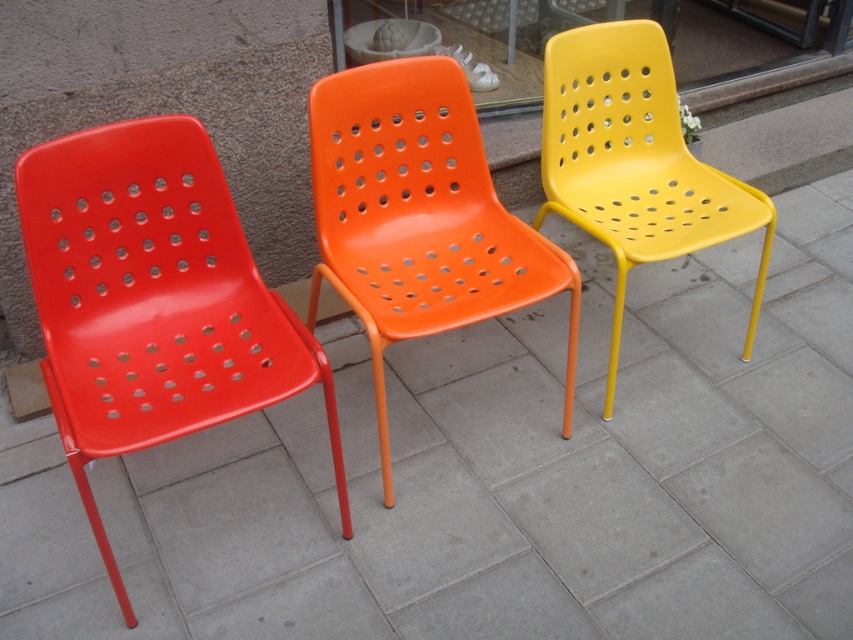
Question: Does glossy plastic chairs at center have a greater width compared to matte plastic chair at left?

Choices:
 (A) yes
 (B) no

Answer: (A)

Question: Is matte plastic chair at left positioned in front of yellow matte plastic chair at right?

Choices:
 (A) no
 (B) yes

Answer: (B)

Question: Where is orange plastic chair at center located in relation to yellow matte plastic chair at right in the image?

Choices:
 (A) above
 (B) below

Answer: (B)

Question: Which of the following is the closest to the observer?

Choices:
 (A) matte plastic chair at left
 (B) yellow matte plastic chair at right
 (C) orange plastic chair at center
 (D) glossy plastic chairs at center

Answer: (A)

Question: Estimate the real-world distances between objects in this image. Which object is farther from the matte plastic chair at left?

Choices:
 (A) yellow matte plastic chair at right
 (B) glossy plastic chairs at center

Answer: (A)

Question: Which of the following is the farthest from the observer?

Choices:
 (A) matte plastic chair at left
 (B) glossy plastic chairs at center
 (C) orange plastic chair at center
 (D) yellow matte plastic chair at right

Answer: (D)